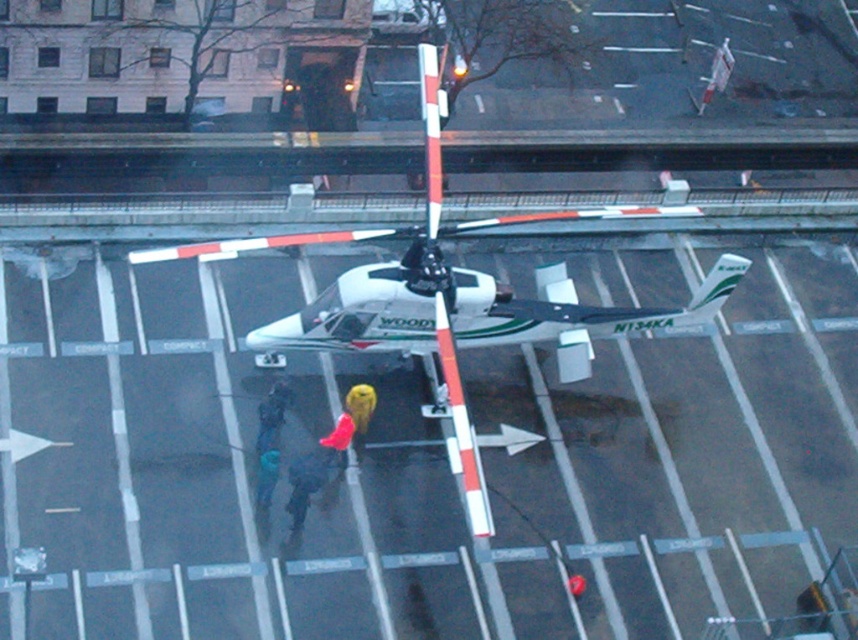
Is white glossy tarmac at center below white matte helicopter at center?

Yes, white glossy tarmac at center is below white matte helicopter at center.

Is point (644, 339) farther from camera compared to point (460, 429)?

Yes, it is.

Find the location of a particular element. The image size is (858, 640). white glossy tarmac at center is located at coordinates (214, 465).